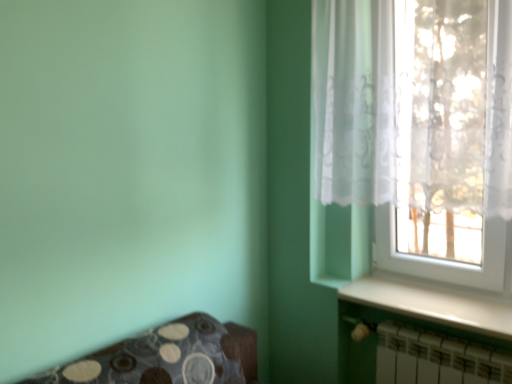
Question: Looking at the image, does translucent fabric at upper right seem bigger or smaller compared to white metallic radiator at lower right?

Choices:
 (A) small
 (B) big

Answer: (B)

Question: Is point (414, 82) positioned closer to the camera than point (437, 357)?

Choices:
 (A) closer
 (B) farther

Answer: (A)

Question: Based on their relative distances, which object is nearer to the white metallic radiator at lower right?

Choices:
 (A) white glossy window sill at lower right
 (B) translucent fabric at upper right

Answer: (A)

Question: Which of these objects is positioned farthest from the translucent fabric at upper right?

Choices:
 (A) white glossy window sill at lower right
 (B) white metallic radiator at lower right

Answer: (B)